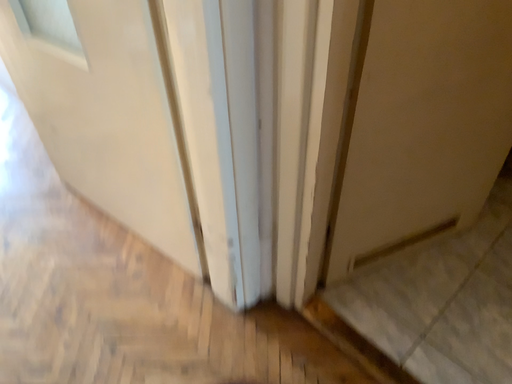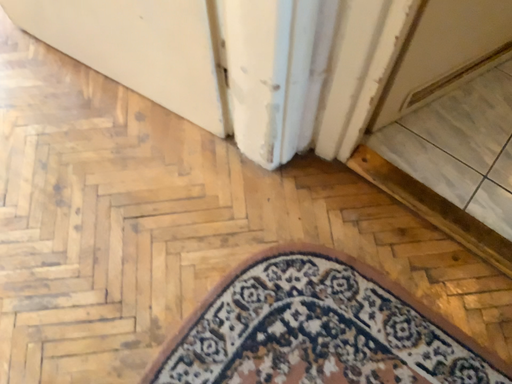
Question: How did the camera likely rotate when shooting the video?

Choices:
 (A) rotated downward
 (B) rotated upward

Answer: (A)